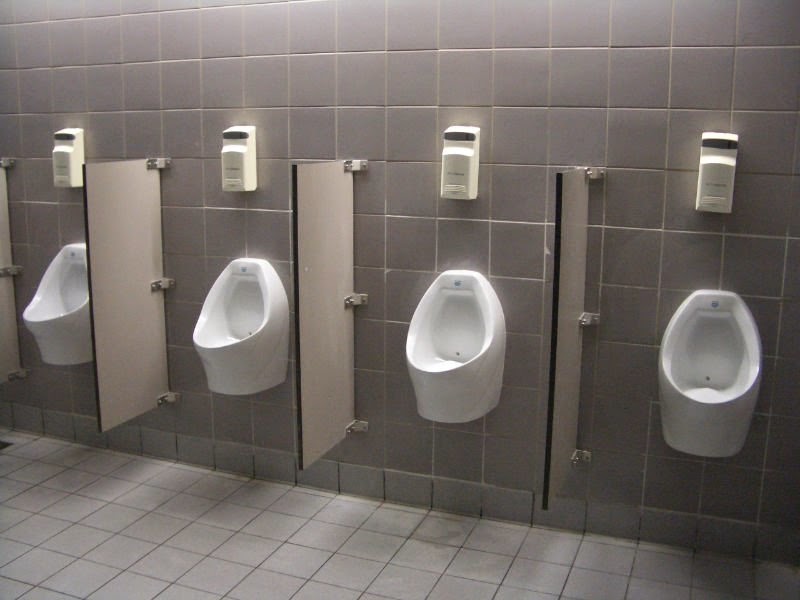
This screenshot has width=800, height=600. Find the location of `air fresheners`. air fresheners is located at coordinates (709, 183), (461, 177), (246, 159), (77, 169).